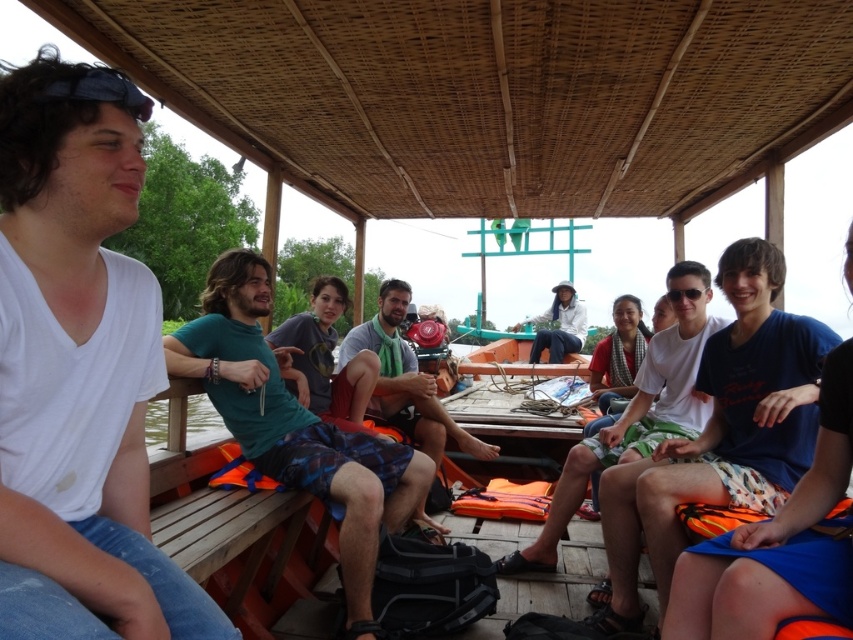
Can you confirm if green fabric shorts at center is positioned above white fabric shirt at center?

No.

Who is shorter, green fabric shorts at center or white fabric shirt at center?

Standing shorter between the two is white fabric shirt at center.

This screenshot has width=853, height=640. Identify the location of green fabric shorts at center. (294, 426).

Measure the distance between white cotton shirt at left and white cotton shirt at center.

They are 7.29 feet apart.

What do you see at coordinates (79, 369) in the screenshot? I see `white cotton shirt at left` at bounding box center [79, 369].

Image resolution: width=853 pixels, height=640 pixels. Describe the element at coordinates (79, 369) in the screenshot. I see `white cotton shirt at left` at that location.

Where is `white cotton shirt at left`? The height and width of the screenshot is (640, 853). white cotton shirt at left is located at coordinates (79, 369).

Is green fabric scarf at center closer to the viewer compared to white fabric shirt at center?

Yes, it is.

Can you confirm if green fabric scarf at center is positioned below white fabric shirt at center?

Yes.

Is point (440, 406) positioned before point (549, 346)?

Yes, it is in front of point (549, 346).

This screenshot has height=640, width=853. I want to click on green fabric scarf at center, so click(405, 380).